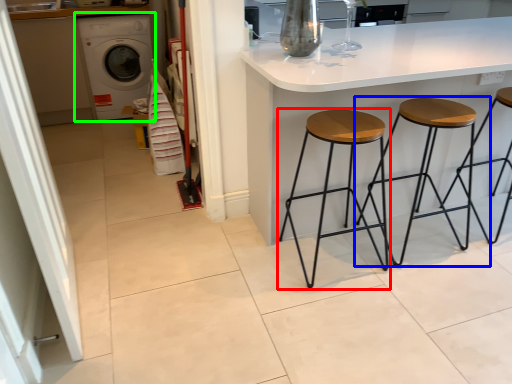
Question: Based on their relative distances, which object is nearer to stool (highlighted by a red box)? Choose from stool (highlighted by a blue box) and washing machine (highlighted by a green box).

Choices:
 (A) stool
 (B) washing machine

Answer: (A)